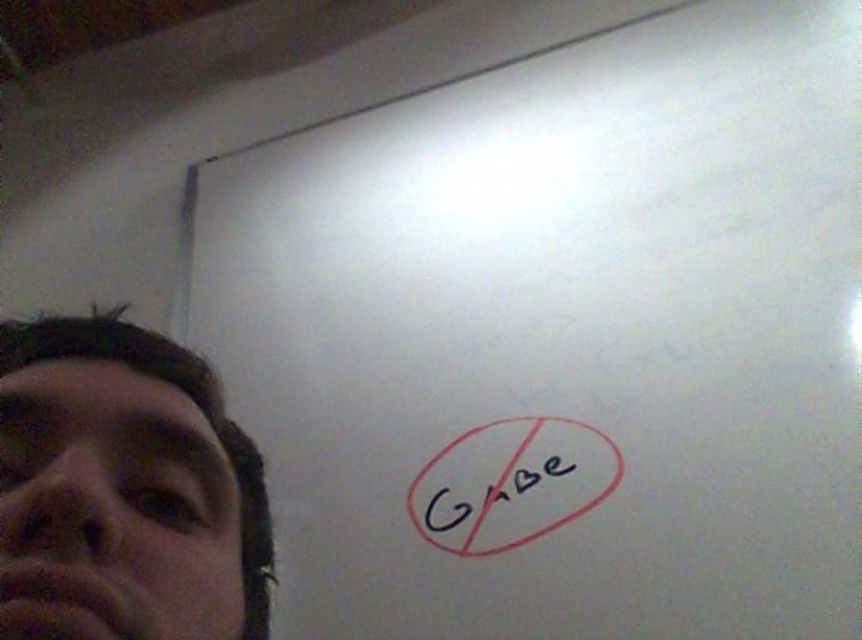
You are holding a laser pointer and want to point at the point at coordinates (116,330) on the whiteboard. The laser pointer has a maximum range of 50 centimeters. Can you reach the point with your laser pointer?

The distance of point (116,330) from camera is 47.92 centimeters, so yes, the laser pointer can reach the point since its distance is within the maximum range of 50 centimeters.

You are a photographer trying to capture a clear photo of the whiteboard without the person in the bottom left corner. The camera you are using has a 120cm focal length. Can you adjust the camera position so that the matte black face at left is not in the photo while still capturing the entire whiteboard?

The matte black face at left and camera are 17.35 inches apart from each other. Since 17.35 inches is approximately 44 cm, which is less than the 120cm focal length, moving the camera back to the focal length distance might still keep the entire whiteboard in frame while excluding the matte black face at left.

You are standing in front of the whiteboard and want to touch both points mentioned. Which point should you reach for first, the point at coordinate (604, 452) or the point at coordinate (28, 326)?

You should reach for the point at coordinate (604, 452) first because it is closer to you than the point at coordinate (28, 326).